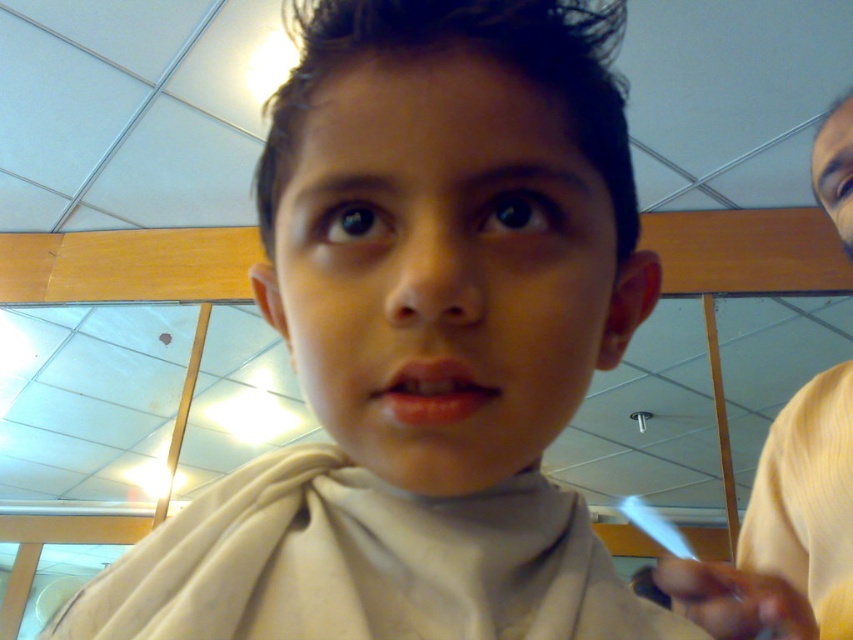
You are a tailor measuring a young boy for a new outfit. You notice the yellow fabric shirt at right and the smooth pink lips at center. Which object is positioned higher in the image?

The yellow fabric shirt at right is much taller than the smooth pink lips at center, so the yellow fabric shirt at right is positioned higher in the image.

You are a tailor measuring a young boy for a new outfit. You notice the yellow fabric shirt at right and the smooth pink lips at center. Which object has a greater width according to the image?

The yellow fabric shirt at right has a greater width than the smooth pink lips at center.

You are a tailor measuring a young boy for a new outfit. You notice the yellow fabric shirt at right and smooth pink lips at center. Which object is bigger in size?

The yellow fabric shirt at right has a larger size compared to the smooth pink lips at center.